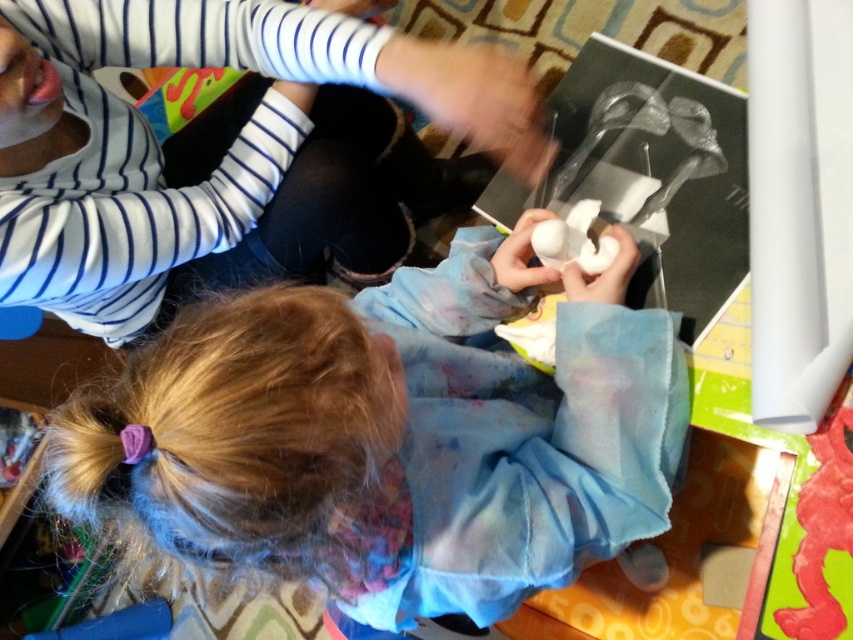
Which is in front, point (592, 465) or point (221, 196)?

Point (592, 465) is in front.

Does point (102, 406) come behind point (68, 22)?

No, (102, 406) is closer to viewer.

I want to click on white fabric at center, so click(393, 433).